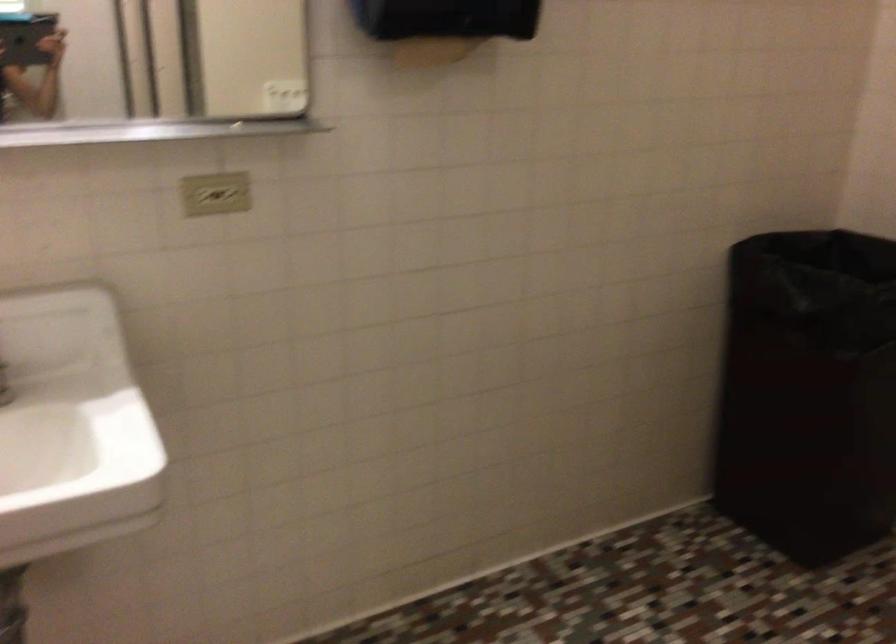
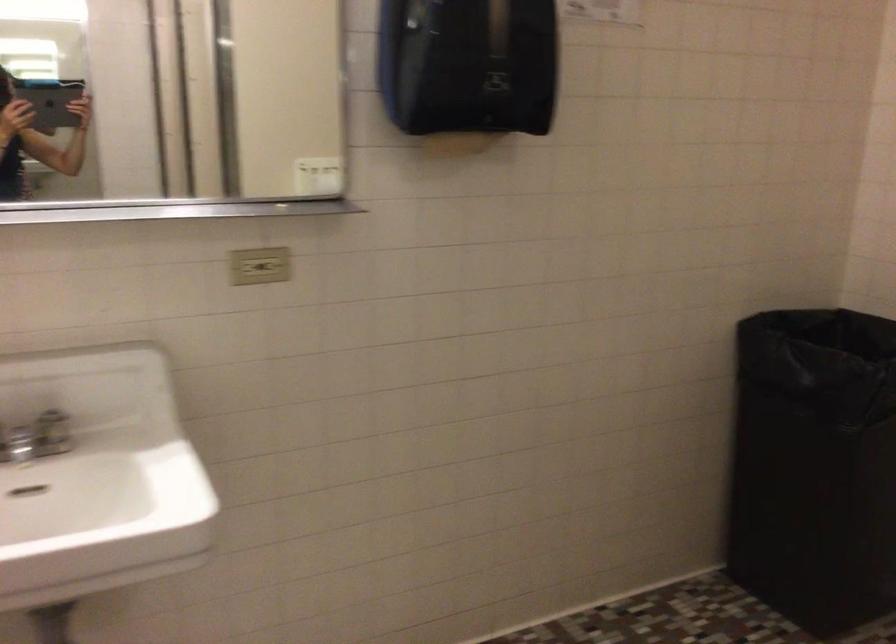
Question: What movement of the cameraman would produce the second image?

Choices:
 (A) Left
 (B) Right
 (C) Forward
 (D) Backward

Answer: (D)